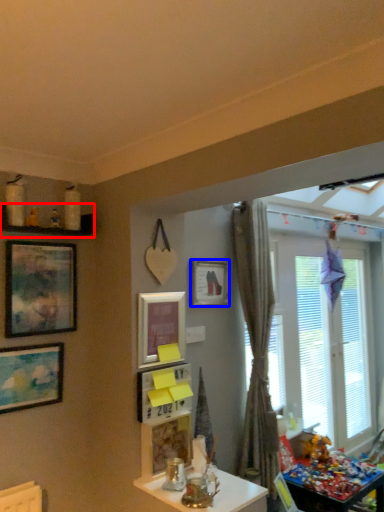
Question: Among these objects, which one is farthest to the camera, shelf (highlighted by a red box) or picture frame (highlighted by a blue box)?

Choices:
 (A) shelf
 (B) picture frame

Answer: (B)